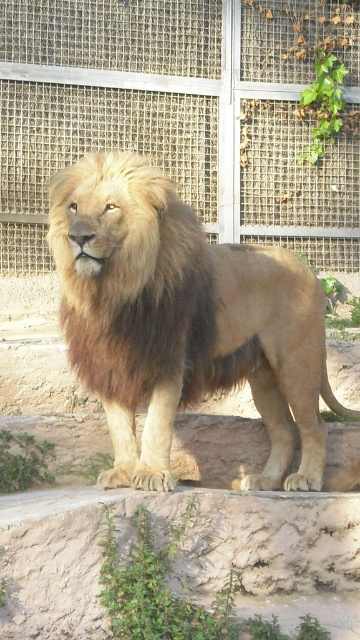
You are a zookeeper standing at the entrance of the lion enclosure. You notice two points marked in the image. Which point is closer to you, point (5,152) or point (105,180)?

Point (105,180) is closer to you because it is less further to the camera than point (5,152).

You are a zookeeper who needs to check the distance between the metal mesh fence at upper center and the golden fur lion at center. According to the description, which object is positioned to the left of the other?

The metal mesh fence at upper center is positioned to the left of the golden fur lion at center.

You are a zookeeper trying to assess the safety of the enclosure. Where is the metal mesh fence at upper center positioned in relation to the lion?

The metal mesh fence at upper center is located at point (183,115), which is the coordinates for its position relative to the lion in the enclosure.